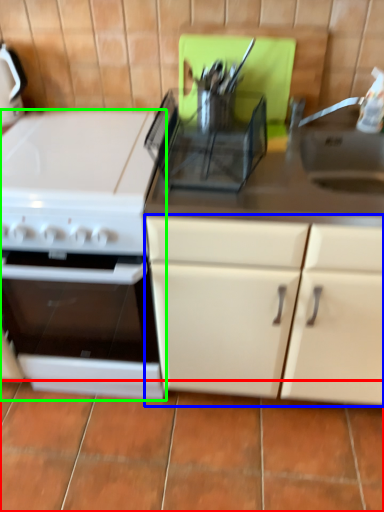
Question: Which object is positioned closest to tile (highlighted by a red box)? Select from cabinetry (highlighted by a blue box) and kitchen appliance (highlighted by a green box).

Choices:
 (A) cabinetry
 (B) kitchen appliance

Answer: (A)